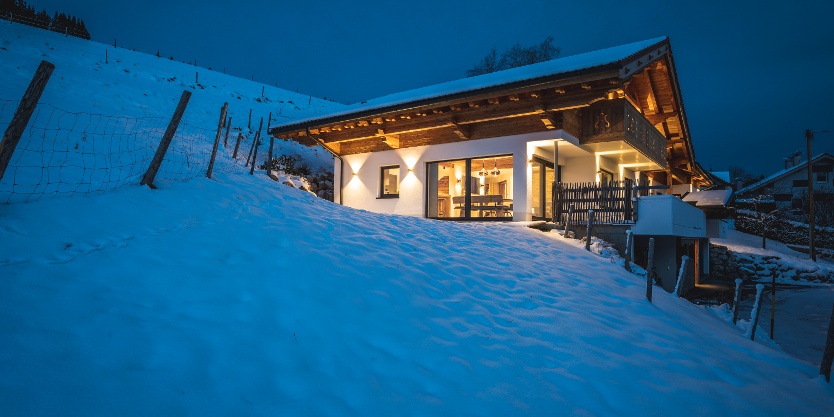
You are a GUI agent. You are given a task and a screenshot of the screen. Output one action in this format:
    pyautogui.click(x=<x>, y=<y>)
    Task: Click on the chairs
    
    Given the screenshot: What is the action you would take?
    pyautogui.click(x=494, y=197), pyautogui.click(x=484, y=199), pyautogui.click(x=496, y=214)